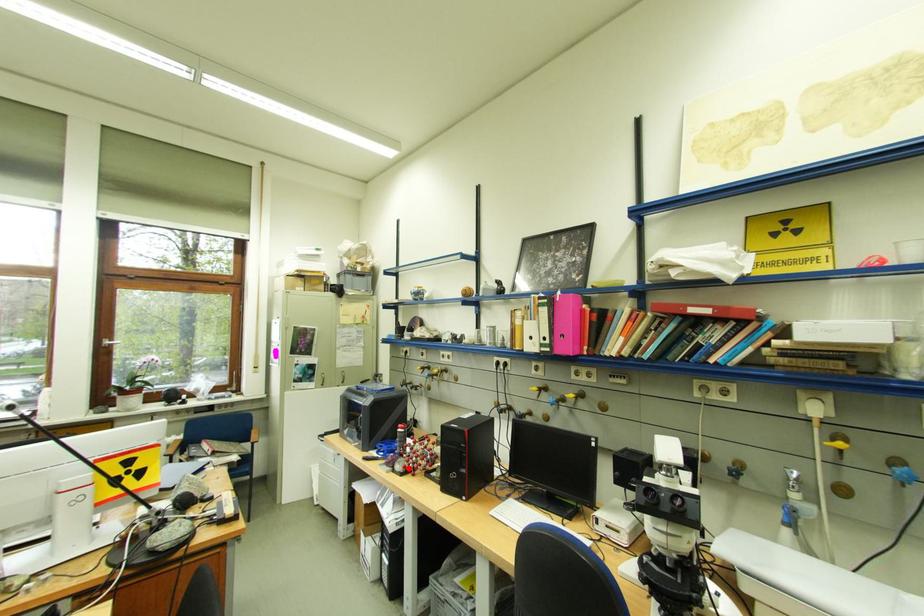
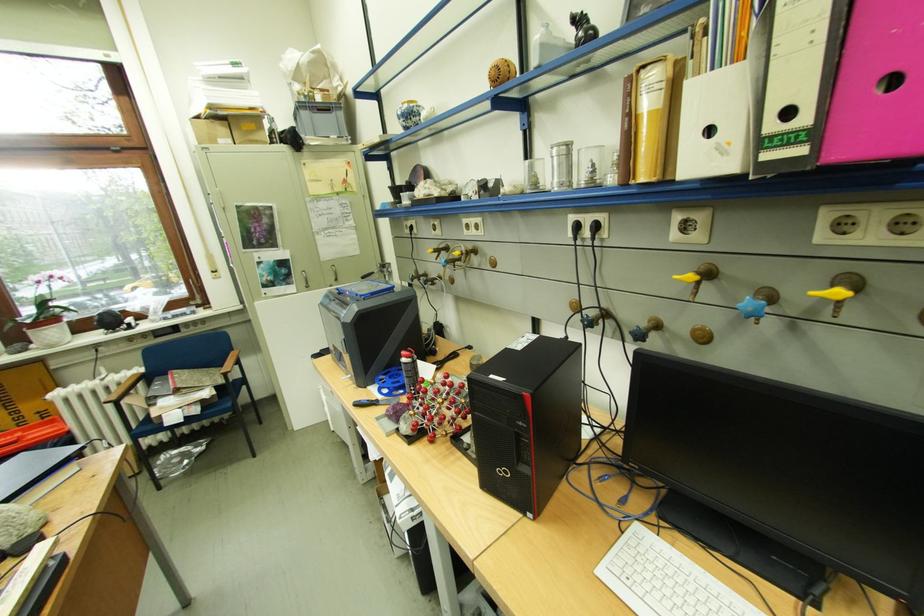
Question: I am providing you with two images of the same scene from different viewpoints. A red point is marked on the first image. At the location where the point appears in image 1, is it still visible in image 2?

Choices:
 (A) Yes
 (B) No

Answer: (A)